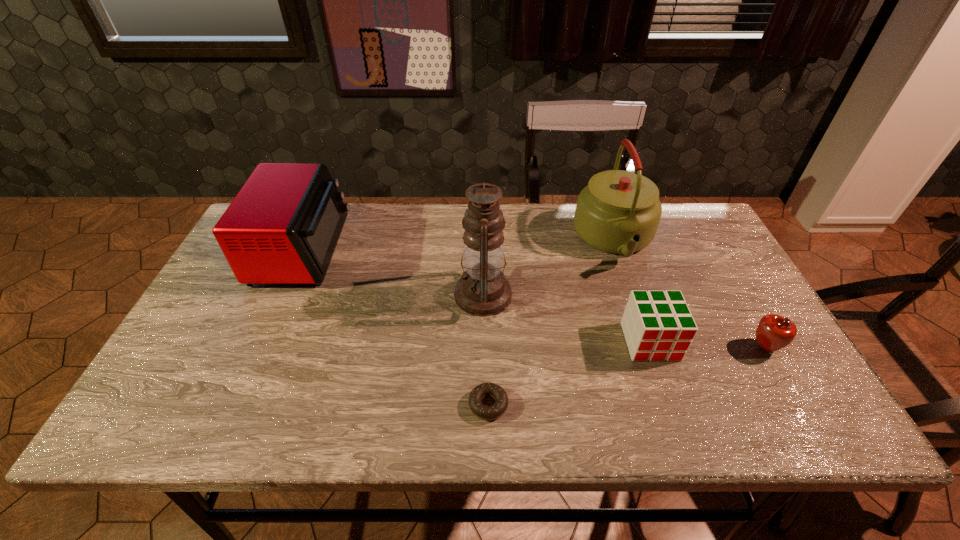
Identify the location of vacant region that satisfies the following two spatial constraints: 1. on the front-facing side of the fourth shortest object; 2. on the left side of the second shortest object. This screenshot has width=960, height=540. (259, 347).

Where is `blank area in the image that satisfies the following two spatial constraints: 1. on the front-facing side of the toaster oven; 2. on the left side of the shortest object`? The width and height of the screenshot is (960, 540). blank area in the image that satisfies the following two spatial constraints: 1. on the front-facing side of the toaster oven; 2. on the left side of the shortest object is located at coordinates (234, 405).

This screenshot has height=540, width=960. I want to click on vacant space that satisfies the following two spatial constraints: 1. on the red face of the cube; 2. on the left side of the rightmost object, so click(652, 347).

The image size is (960, 540). I want to click on vacant point that satisfies the following two spatial constraints: 1. on the front-facing side of the leftmost object; 2. on the left side of the apple, so click(x=259, y=347).